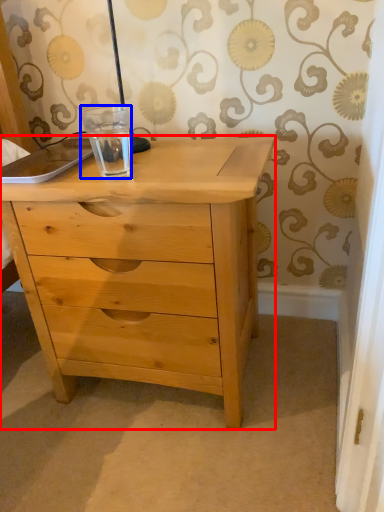
Question: Which of the following is the farthest to the observer, chest of drawers (highlighted by a red box) or glass jar (highlighted by a blue box)?

Choices:
 (A) chest of drawers
 (B) glass jar

Answer: (B)